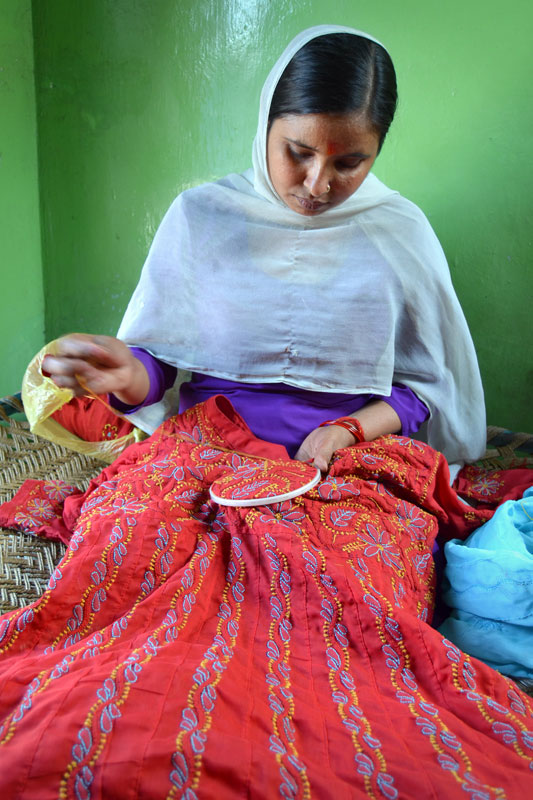
In order to click on blanket in this screenshot , I will do `click(511, 576)`.